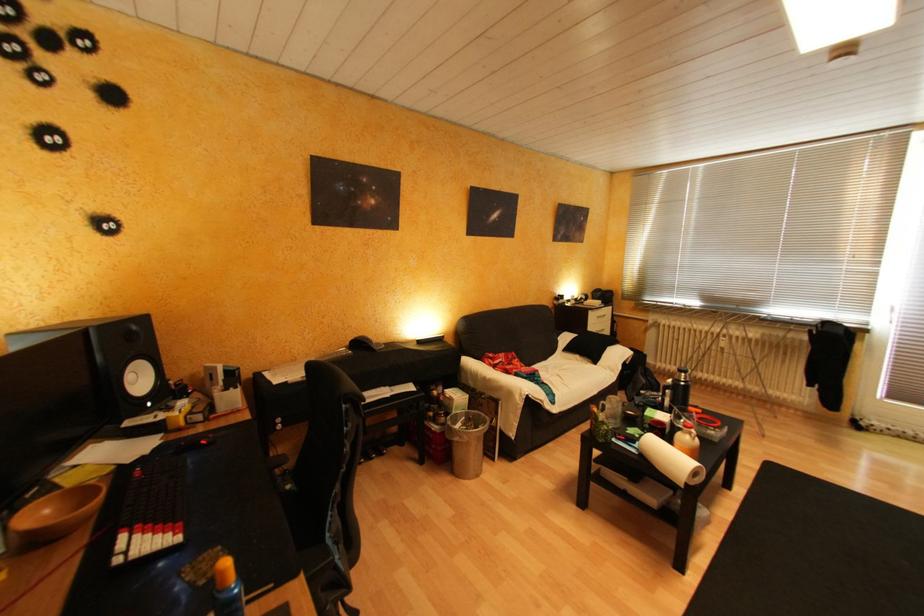
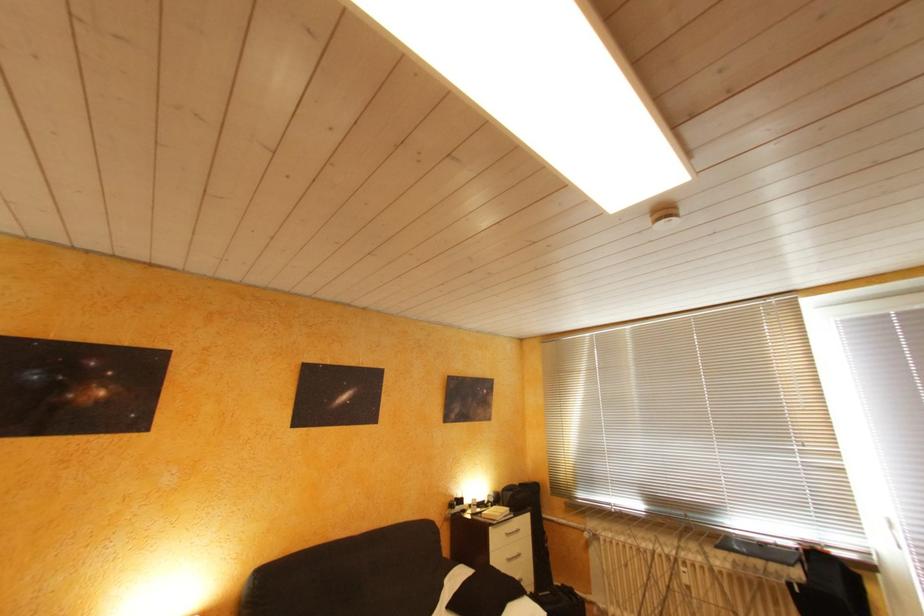
Consider the image. The images are taken continuously from a first-person perspective. In which direction are you moving?

The cameraman moved toward right, forward.